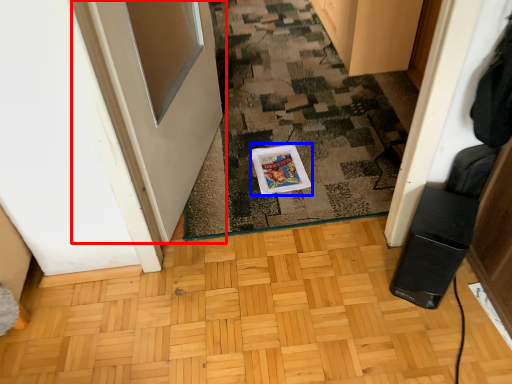
Question: Which point is further to the camera, door (highlighted by a red box) or postcard (highlighted by a blue box)?

Choices:
 (A) door
 (B) postcard

Answer: (B)